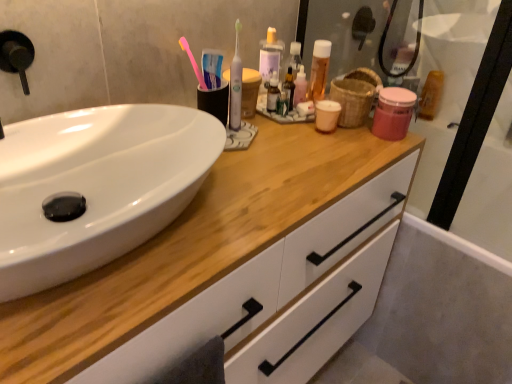
Where is `spots to the right of pink plastic toothbrush at upper center, the 1th toothbrush in the left-to-right sequence`? The height and width of the screenshot is (384, 512). spots to the right of pink plastic toothbrush at upper center, the 1th toothbrush in the left-to-right sequence is located at coordinates (279, 144).